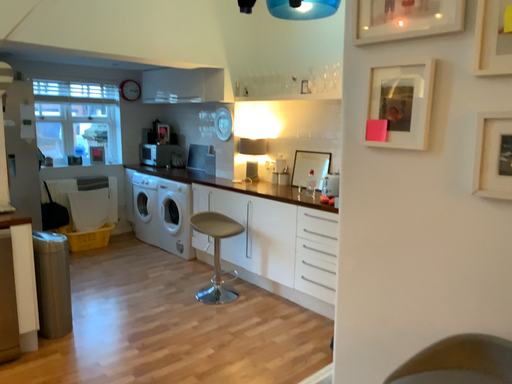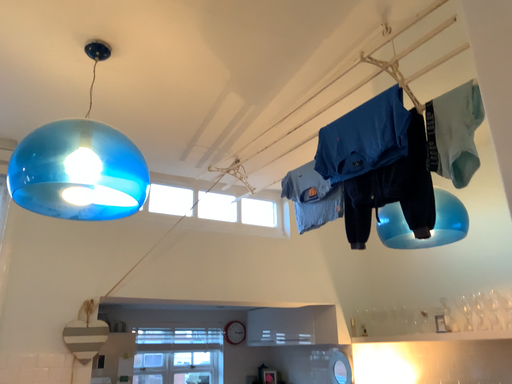
Question: How did the camera likely rotate when shooting the video?

Choices:
 (A) rotated left
 (B) rotated right

Answer: (A)